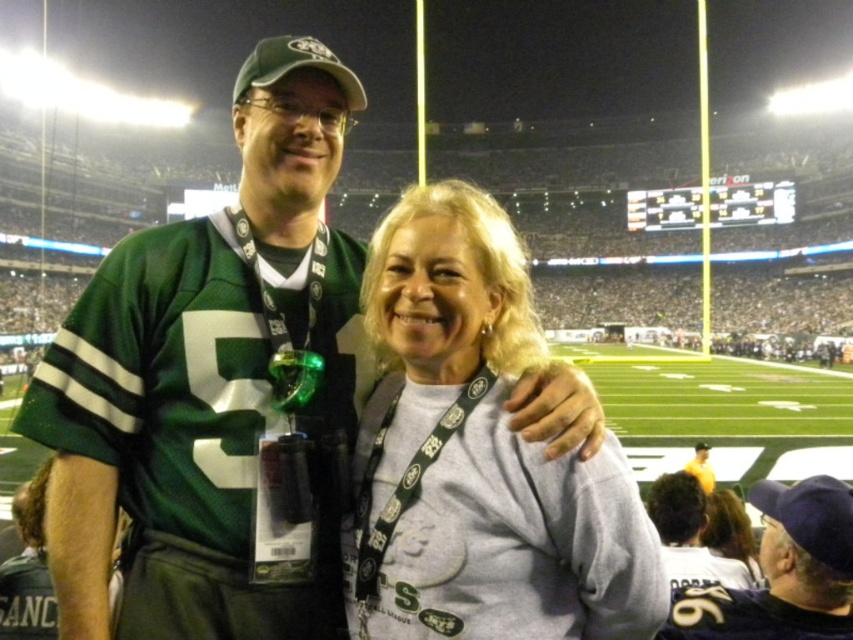
Looking at this image, you are a photographer at the football stadium and want to capture both the matte green jersey at center and the yellow jersey at center in a single photo. Given their heights, which jersey should be placed closer to the camera to ensure both are fully visible in the frame?

The matte green jersey at center is much taller than the yellow jersey at center, so to ensure both are fully visible in the frame, the yellow jersey at center should be placed closer to the camera.

You are standing in the football stadium and want to locate the matte green jersey at center. According to the coordinates provided, where should you look?

The matte green jersey at center is located at point coordinates of (x=782, y=572).

You are a photographer at the stadium and want to capture both the matte green jersey at center and the white jersey at center in a single photo. Which jersey should you focus on first to ensure both are in frame?

The matte green jersey at center is bigger than the white jersey at center, so you should focus on the matte green jersey at center first to ensure both fit within the frame.